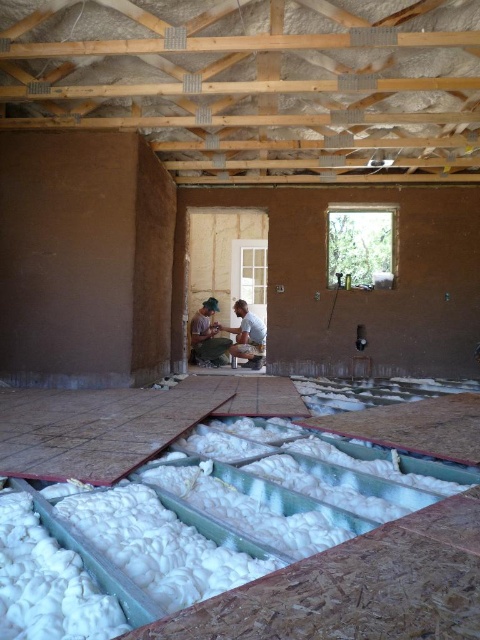
Is white fluffy cotton at lower center below matte brown man at center?

Yes, white fluffy cotton at lower center is below matte brown man at center.

Does white fluffy cotton at lower center have a lesser height compared to matte brown man at center?

Yes, white fluffy cotton at lower center is shorter than matte brown man at center.

Who is more distant from viewer, (134, 586) or (257, 355)?

Point (257, 355)

You are a GUI agent. You are given a task and a screenshot of the screen. Output one action in this format:
    pyautogui.click(x=<x>, y=<y>)
    Task: Click on the white fluffy cotton at lower center
    This screenshot has height=640, width=480.
    Given the screenshot: What is the action you would take?
    pyautogui.click(x=95, y=563)

Between point (73, 538) and point (207, 316), which one is positioned in front?

Positioned in front is point (73, 538).

Who is positioned more to the right, white fluffy cotton at lower center or matte brown shirt at center?

white fluffy cotton at lower center is more to the right.

What are the coordinates of `white fluffy cotton at lower center` in the screenshot? It's located at (95, 563).

Does matte brown shirt at center appear on the left side of matte brown man at center?

Correct, you'll find matte brown shirt at center to the left of matte brown man at center.

This screenshot has height=640, width=480. What do you see at coordinates (206, 337) in the screenshot? I see `matte brown shirt at center` at bounding box center [206, 337].

You are a GUI agent. You are given a task and a screenshot of the screen. Output one action in this format:
    pyautogui.click(x=<x>, y=<y>)
    Task: Click on the matte brown shirt at center
    This screenshot has height=640, width=480.
    Given the screenshot: What is the action you would take?
    (x=206, y=337)